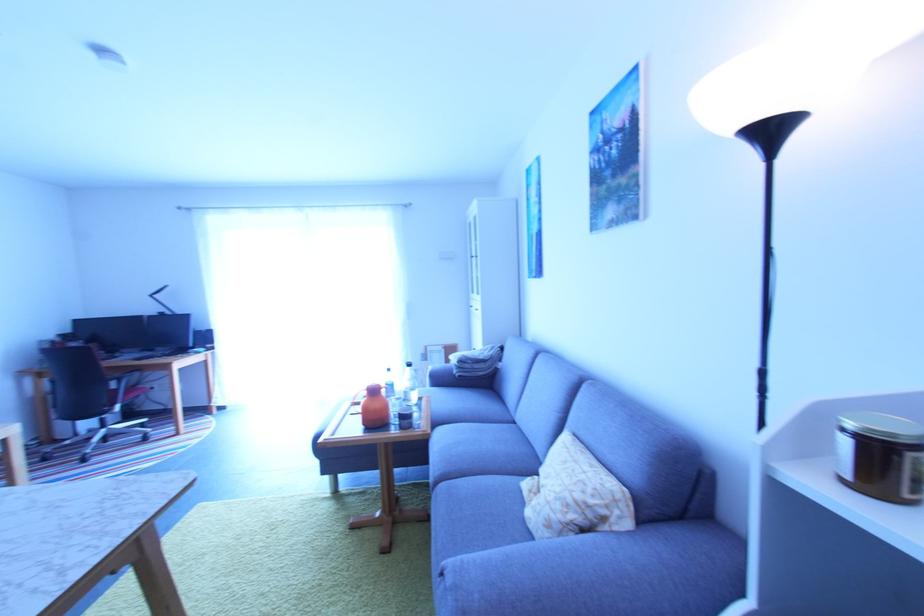
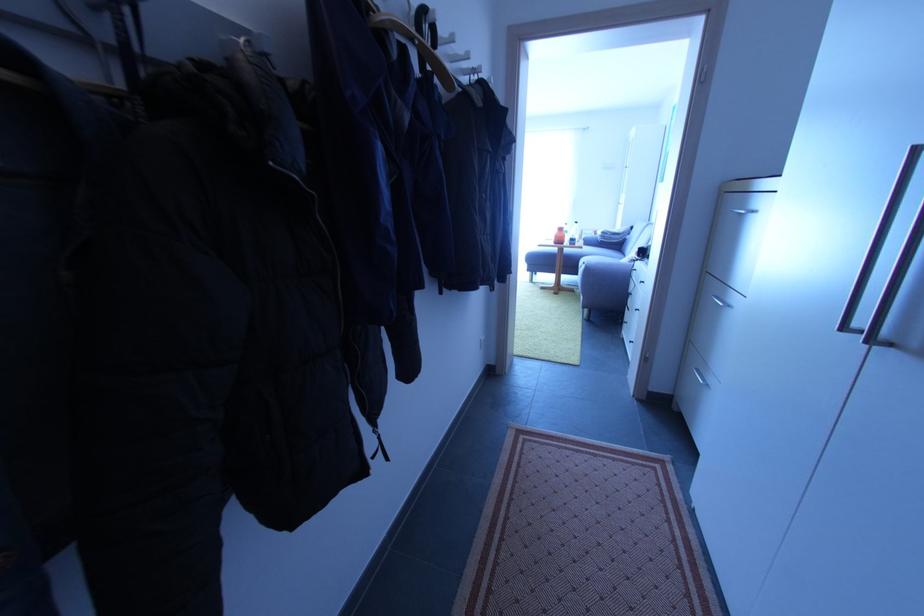
In the second image, find the point that corresponds to point (440, 485) in the first image.

(586, 268)